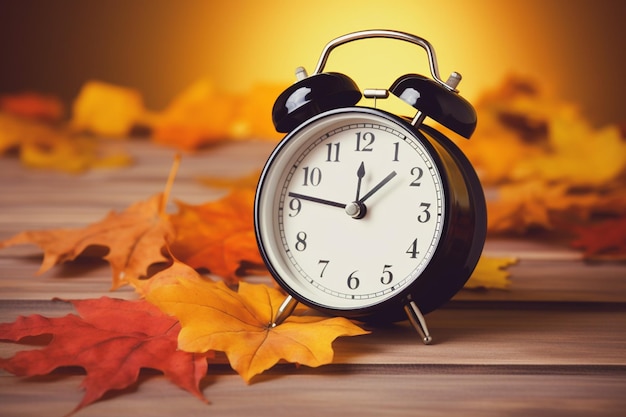
What are the coordinates of `clock alarm handle` in the screenshot? It's located at (379, 29).